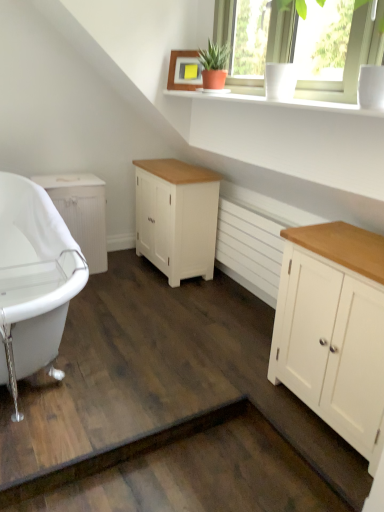
Locate an element on the screen. free space to the right of white glossy bathtub at lower left is located at coordinates (164, 344).